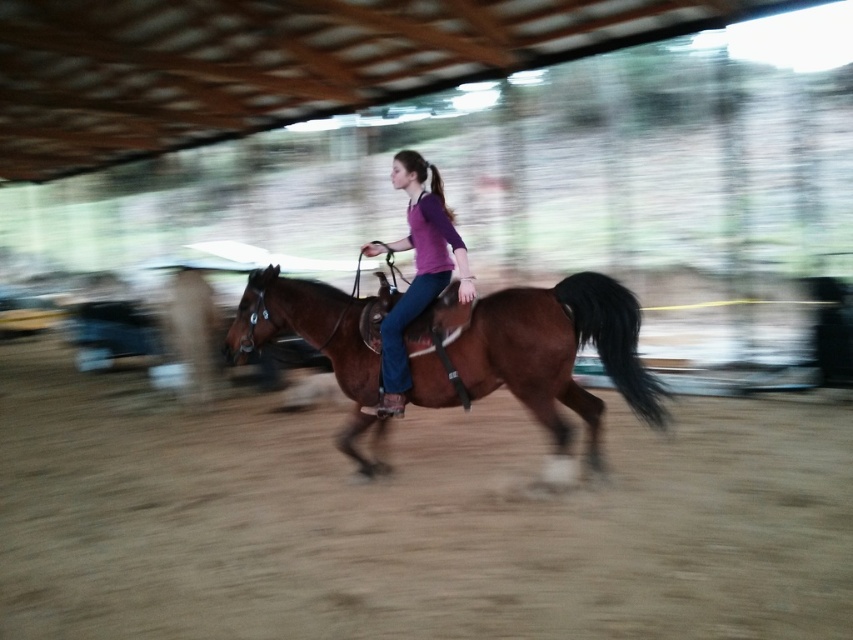
How distant is brown sandy dirt track at center from purple matte shirt at center?

A distance of 2.05 meters exists between brown sandy dirt track at center and purple matte shirt at center.

Between brown sandy dirt track at center and purple matte shirt at center, which one is positioned lower?

brown sandy dirt track at center is below.

What do you see at coordinates (410, 520) in the screenshot? This screenshot has width=853, height=640. I see `brown sandy dirt track at center` at bounding box center [410, 520].

The height and width of the screenshot is (640, 853). Identify the location of brown sandy dirt track at center. (410, 520).

Can you confirm if brown leather horse at center is positioned below purple matte shirt at center?

Indeed, brown leather horse at center is positioned under purple matte shirt at center.

Which is more to the left, brown leather horse at center or purple matte shirt at center?

Positioned to the left is purple matte shirt at center.

Between point (489, 374) and point (431, 243), which one is positioned in front?

Positioned in front is point (489, 374).

Where is `brown leather horse at center`? This screenshot has height=640, width=853. brown leather horse at center is located at coordinates (538, 355).

Can you confirm if brown sandy dirt track at center is smaller than brown leather horse at center?

Correct, brown sandy dirt track at center occupies less space than brown leather horse at center.

Who is more distant from viewer, [827,435] or [358,396]?

The point [827,435] is behind.

Does point (210, 477) come closer to viewer compared to point (347, 433)?

That is False.

What are the coordinates of `brown sandy dirt track at center` in the screenshot? It's located at (410, 520).